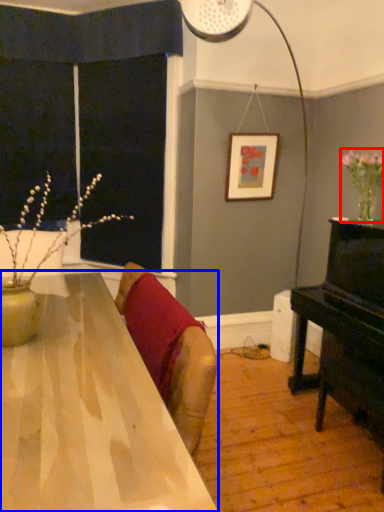
Question: Which object appears farthest to the camera in this image, floral arrangement (highlighted by a red box) or table (highlighted by a blue box)?

Choices:
 (A) floral arrangement
 (B) table

Answer: (A)